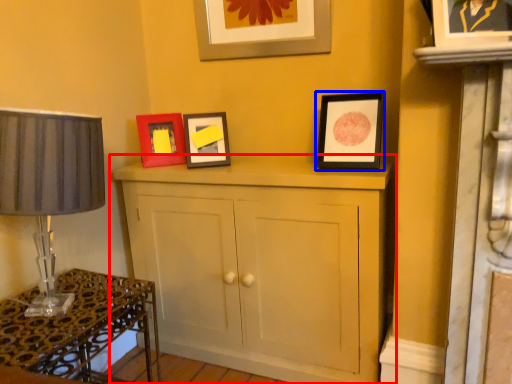
Question: Which point is closer to the camera, cupboard (highlighted by a red box) or picture frame (highlighted by a blue box)?

Choices:
 (A) cupboard
 (B) picture frame

Answer: (A)